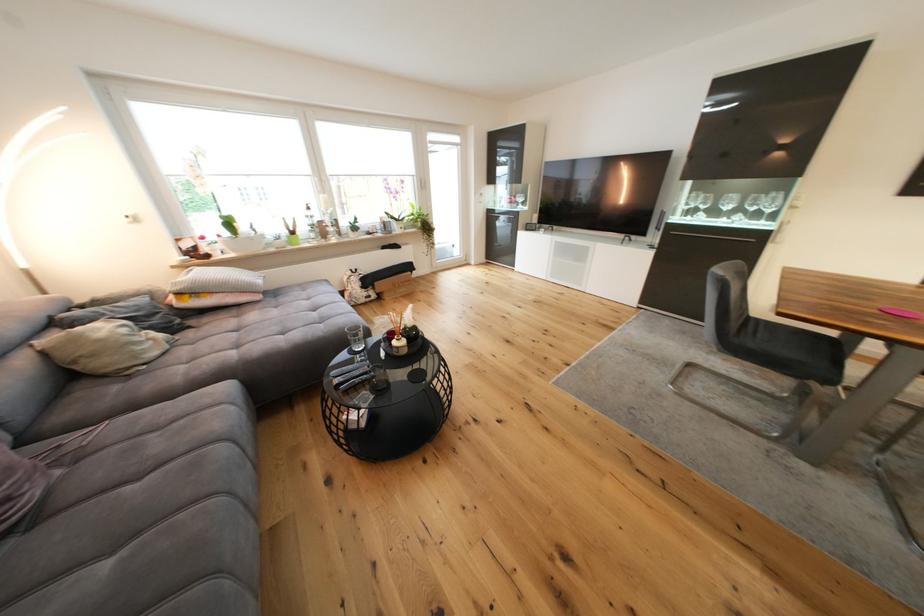
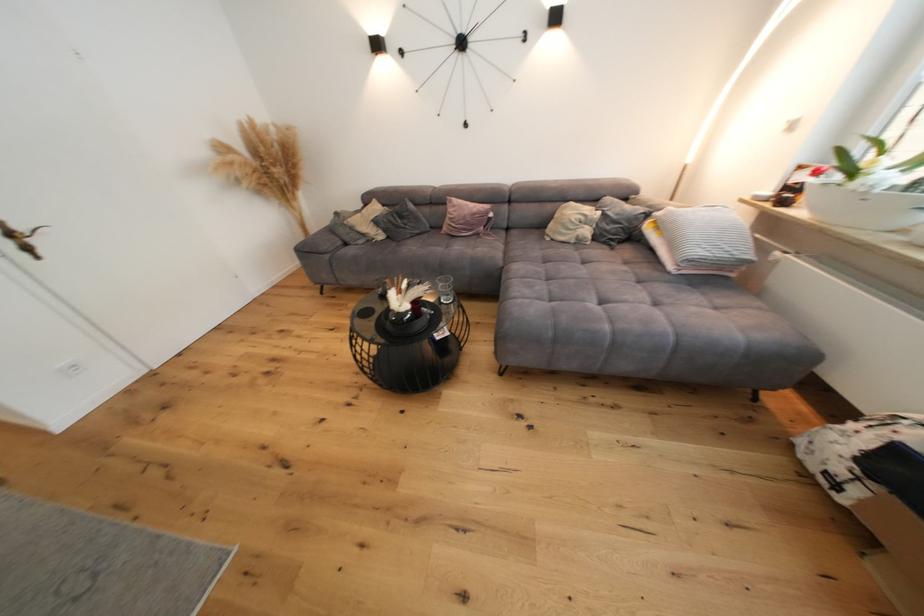
Where in the second image is the point corresponding to the point at 193,246 from the first image?

(809, 179)